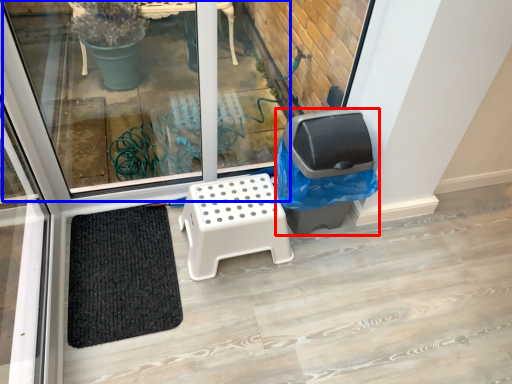
Question: Which point is further to the camera, garbage (highlighted by a red box) or window (highlighted by a blue box)?

Choices:
 (A) garbage
 (B) window

Answer: (A)